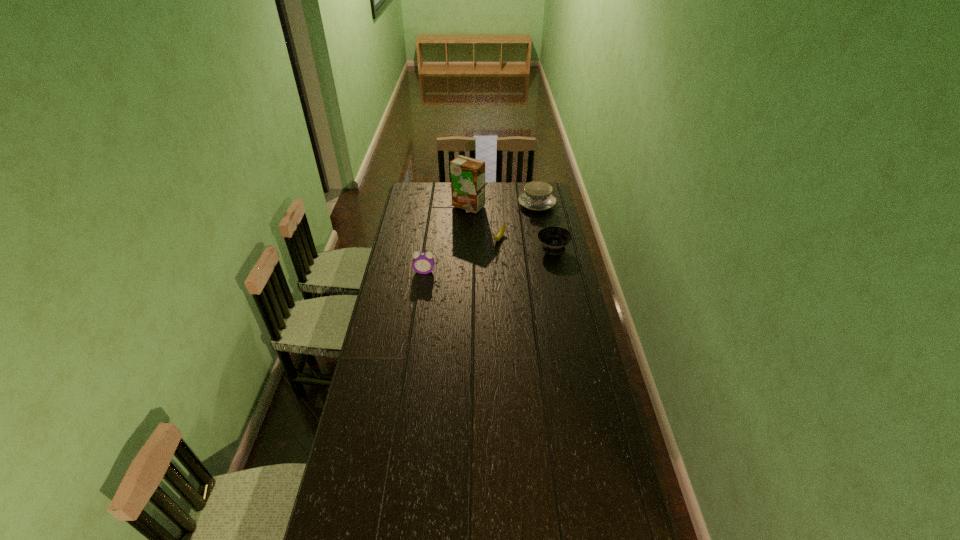
In order to click on the leftmost object in this screenshot , I will do 423,262.

At what (x,y) coordinates should I click in order to perform the action: click on the nearest object. Please return your answer as a coordinate pair (x, y). Looking at the image, I should click on (423, 262).

Identify the location of bowl. pyautogui.click(x=554, y=239).

The width and height of the screenshot is (960, 540). In order to click on chinaware in this screenshot , I will do `click(537, 196)`.

This screenshot has height=540, width=960. Find the location of `carton`. carton is located at coordinates (467, 174).

Where is `the fourth object from right to left`? the fourth object from right to left is located at coordinates (467, 174).

Where is `the third object from left to right`? This screenshot has width=960, height=540. the third object from left to right is located at coordinates (499, 235).

I want to click on vacant area located 0.100m on the face of the alarm clock, so click(x=421, y=288).

The width and height of the screenshot is (960, 540). Find the location of `vacant region located on the left of the bowl`. vacant region located on the left of the bowl is located at coordinates (516, 249).

Image resolution: width=960 pixels, height=540 pixels. Identify the location of vacant space located with the handle on the side of the chinaware. (516, 225).